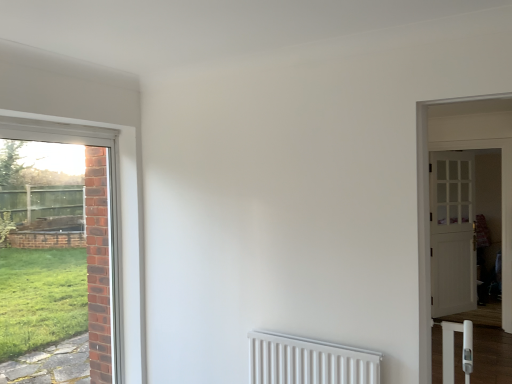
Measure the distance between white plastic radiator at lower center and camera.

The depth of white plastic radiator at lower center is 7.06 feet.

Describe the element at coordinates (452, 233) in the screenshot. This screenshot has height=384, width=512. I see `white wooden door at right, the first door from the right` at that location.

Where is `matte glass door at left, which appears as the 3th door when viewed from the right`? matte glass door at left, which appears as the 3th door when viewed from the right is located at coordinates (108, 205).

Find the location of a particular element. This screenshot has height=384, width=512. white wooden door at right, arranged as the second door when viewed from the left is located at coordinates (502, 177).

This screenshot has width=512, height=384. Find the location of `white plastic radiator at lower center`. white plastic radiator at lower center is located at coordinates (308, 361).

From the image's perspective, which one is positioned higher, white wooden door at right, the second door viewed from the right, or white wooden door at right, the 1th door when ordered from back to front?

From the image's view, white wooden door at right, the second door viewed from the right, is above.

Relative to white wooden door at right, the first door from the right, is white wooden door at right, the second door viewed from the right, in front or behind?

In the image, white wooden door at right, the second door viewed from the right, appears in front of white wooden door at right, the first door from the right.

Considering the sizes of white wooden door at right, placed as the second door when sorted from front to back, and white wooden door at right, arranged as the 3th door when viewed from the left, in the image, is white wooden door at right, placed as the second door when sorted from front to back, wider or thinner than white wooden door at right, arranged as the 3th door when viewed from the left,?

white wooden door at right, placed as the second door when sorted from front to back, is wider than white wooden door at right, arranged as the 3th door when viewed from the left.

Is white wooden door at right, arranged as the second door when viewed from the left, far away from matte glass door at left, which appears as the 3th door when viewed from the right?

white wooden door at right, arranged as the second door when viewed from the left, is far away from matte glass door at left, which appears as the 3th door when viewed from the right.

Measure the distance between white wooden door at right, arranged as the second door when viewed from the left, and matte glass door at left, which appears as the 3th door when viewed from the right.

The distance of white wooden door at right, arranged as the second door when viewed from the left, from matte glass door at left, which appears as the 3th door when viewed from the right, is 3.76 meters.

From the image's perspective, is white wooden door at right, arranged as the second door when viewed from the left, located beneath matte glass door at left, which appears as the 3th door when viewed from the right?

Actually, white wooden door at right, arranged as the second door when viewed from the left, appears above matte glass door at left, which appears as the 3th door when viewed from the right, in the image.

Considering the positions of objects white wooden door at right, arranged as the second door when viewed from the left, and matte glass door at left, which is counted as the 3th door, starting from the back, in the image provided, who is more to the left, white wooden door at right, arranged as the second door when viewed from the left, or matte glass door at left, which is counted as the 3th door, starting from the back,?

From the viewer's perspective, matte glass door at left, which is counted as the 3th door, starting from the back, appears more on the left side.

Is white wooden door at right, the first door from the right, oriented away from matte glass door at left, the 1th door viewed from the front?

No.

The height and width of the screenshot is (384, 512). I want to click on the 2nd door counting from the left of the white wooden door at right, the third door from the front, so click(x=108, y=205).

From a real-world perspective, is white wooden door at right, the 1th door when ordered from back to front, physically located above or below matte glass door at left, which is counted as the 3th door, starting from the back?

From a real-world perspective, white wooden door at right, the 1th door when ordered from back to front, is physically below matte glass door at left, which is counted as the 3th door, starting from the back.

Based on the photo, could you measure the distance between white wooden door at right, the 1th door when ordered from back to front, and matte glass door at left, which is counted as the 3th door, starting from the back?

A distance of 13.26 feet exists between white wooden door at right, the 1th door when ordered from back to front, and matte glass door at left, which is counted as the 3th door, starting from the back.

Does matte glass door at left, which is counted as the 3th door, starting from the back, touch white wooden door at right, arranged as the 3th door when viewed from the left?

There is a gap between matte glass door at left, which is counted as the 3th door, starting from the back, and white wooden door at right, arranged as the 3th door when viewed from the left.

Which is less distant, (96,133) or (452,308)?

Clearly, point (96,133) is closer to the camera than point (452,308).

Who is more distant, matte glass door at left, which appears as the 3th door when viewed from the right, or white wooden door at right, the first door from the right?

white wooden door at right, the first door from the right, is further from the camera.

Considering the sizes of objects matte glass door at left, the 1th door viewed from the front, and white wooden door at right, the third door from the front, in the image provided, who is thinner, matte glass door at left, the 1th door viewed from the front, or white wooden door at right, the third door from the front,?

Thinner between the two is matte glass door at left, the 1th door viewed from the front.

Is white wooden door at right, arranged as the 3th door when viewed from the left, wider or thinner than white plastic radiator at lower center?

Considering their sizes, white wooden door at right, arranged as the 3th door when viewed from the left, looks slimmer than white plastic radiator at lower center.

Considering the sizes of white wooden door at right, the third door from the front, and white plastic radiator at lower center in the image, is white wooden door at right, the third door from the front, bigger or smaller than white plastic radiator at lower center?

Considering their sizes, white wooden door at right, the third door from the front, takes up more space than white plastic radiator at lower center.

From a real-world perspective, is white wooden door at right, the third door from the front, above or below white plastic radiator at lower center?

From a real-world perspective, white wooden door at right, the third door from the front, is physically above white plastic radiator at lower center.

Is white wooden door at right, arranged as the 3th door when viewed from the left, to the right of white plastic radiator at lower center from the viewer's perspective?

Yes, white wooden door at right, arranged as the 3th door when viewed from the left, is to the right of white plastic radiator at lower center.

Is white wooden door at right, the 1th door when ordered from back to front, to the right of white wooden door at right, placed as the second door when sorted from front to back, from the viewer's perspective?

Yes.

Is white wooden door at right, the first door from the right, facing away from white wooden door at right, arranged as the second door when viewed from the left?

Absolutely, white wooden door at right, the first door from the right, is directed away from white wooden door at right, arranged as the second door when viewed from the left.

From the image's perspective, count 1st doors downward from the white wooden door at right, placed as the second door when sorted from front to back, and point to it. Please provide its 2D coordinates.

[(452, 233)]

Is white wooden door at right, the first door from the right, in front of white wooden door at right, the 2th door in the back-to-front sequence?

No.

Which of these two, white plastic radiator at lower center or matte glass door at left, which appears as the 3th door when viewed from the right, stands shorter?

Standing shorter between the two is white plastic radiator at lower center.

In the scene shown: Can you tell me how much white plastic radiator at lower center and matte glass door at left, placed as the 1th door when sorted from left to right, differ in facing direction?

The facing directions of white plastic radiator at lower center and matte glass door at left, placed as the 1th door when sorted from left to right, are 89.8 degrees apart.

Is point (317, 363) behind point (111, 159)?

That is False.

This screenshot has width=512, height=384. Find the location of `door that is the 1st object located in front of the white wooden door at right, the 1th door when ordered from back to front`. door that is the 1st object located in front of the white wooden door at right, the 1th door when ordered from back to front is located at coordinates (502, 177).

From the image's perspective, which door is the 2nd one below the white wooden door at right, the second door viewed from the right? Please provide its 2D coordinates.

[(108, 205)]

Based on their spatial positions, is white wooden door at right, the first door from the right, or white plastic radiator at lower center closer to matte glass door at left, which is counted as the 3th door, starting from the back?

Based on the image, white plastic radiator at lower center appears to be nearer to matte glass door at left, which is counted as the 3th door, starting from the back.

Estimate the real-world distances between objects in this image. Which object is further from white wooden door at right, the second door viewed from the right, matte glass door at left, the 1th door viewed from the front, or white plastic radiator at lower center?

matte glass door at left, the 1th door viewed from the front, is further to white wooden door at right, the second door viewed from the right.

When comparing their distances from white wooden door at right, the 2th door in the back-to-front sequence, does white wooden door at right, the third door from the front, or matte glass door at left, placed as the 1th door when sorted from left to right, seem further?

Among the two, matte glass door at left, placed as the 1th door when sorted from left to right, is located further to white wooden door at right, the 2th door in the back-to-front sequence.

In the scene shown: Estimate the real-world distances between objects in this image. Which object is closer to white wooden door at right, the 1th door when ordered from back to front, white wooden door at right, arranged as the second door when viewed from the left, or matte glass door at left, the 1th door viewed from the front?

white wooden door at right, arranged as the second door when viewed from the left, is closer to white wooden door at right, the 1th door when ordered from back to front.

In the scene shown: Considering their positions, is matte glass door at left, which is counted as the 3th door, starting from the back, positioned further to white wooden door at right, the third door from the front, than white wooden door at right, arranged as the second door when viewed from the left?

Among the two, matte glass door at left, which is counted as the 3th door, starting from the back, is located further to white wooden door at right, the third door from the front.

In the scene shown: Estimate the real-world distances between objects in this image. Which object is further from white plastic radiator at lower center, white wooden door at right, arranged as the second door when viewed from the left, or white wooden door at right, arranged as the 3th door when viewed from the left?

white wooden door at right, arranged as the 3th door when viewed from the left, is positioned further to the anchor white plastic radiator at lower center.

Estimate the real-world distances between objects in this image. Which object is further from white wooden door at right, the 2th door in the back-to-front sequence, white plastic radiator at lower center or matte glass door at left, the 1th door viewed from the front?

Based on the image, matte glass door at left, the 1th door viewed from the front, appears to be further to white wooden door at right, the 2th door in the back-to-front sequence.

Based on their spatial positions, is white wooden door at right, the 1th door when ordered from back to front, or white wooden door at right, the 2th door in the back-to-front sequence, further from white plastic radiator at lower center?

white wooden door at right, the 1th door when ordered from back to front.

This screenshot has height=384, width=512. I want to click on door located between matte glass door at left, the 1th door viewed from the front, and white wooden door at right, arranged as the 3th door when viewed from the left, in the left-right direction, so click(502, 177).

Identify the location of radiator located between matte glass door at left, which appears as the 3th door when viewed from the right, and white wooden door at right, arranged as the 3th door when viewed from the left, in the left-right direction. (308, 361).

Find the location of a particular element. The height and width of the screenshot is (384, 512). radiator between matte glass door at left, which is counted as the 3th door, starting from the back, and white wooden door at right, arranged as the second door when viewed from the left, in the horizontal direction is located at coordinates (308, 361).